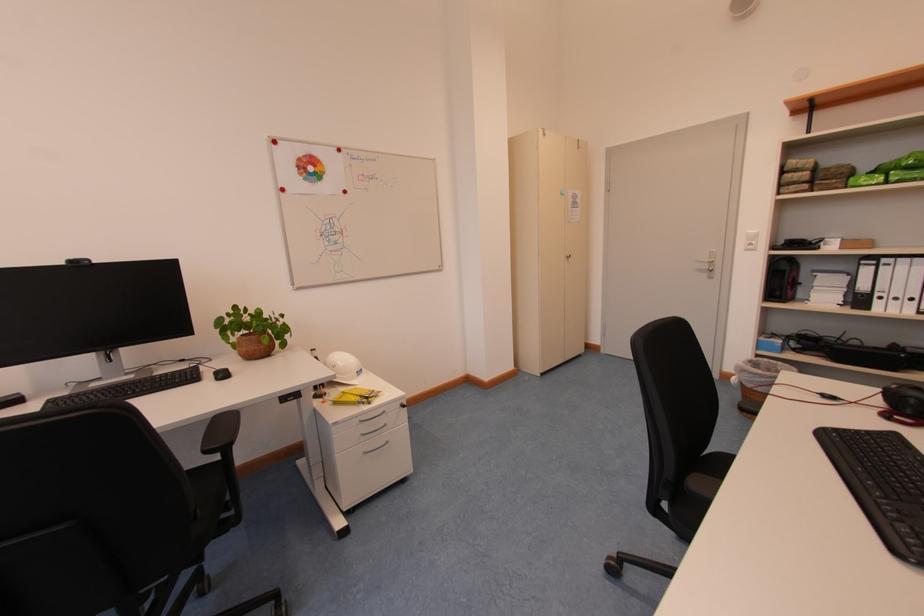
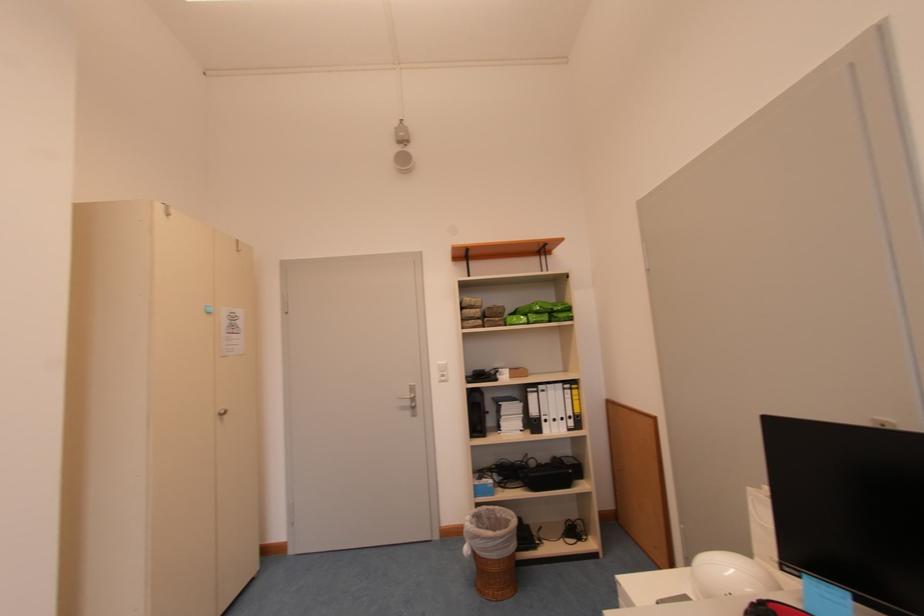
Find the pixel in the second image that matches the point at 787,365 in the first image.

(504, 509)